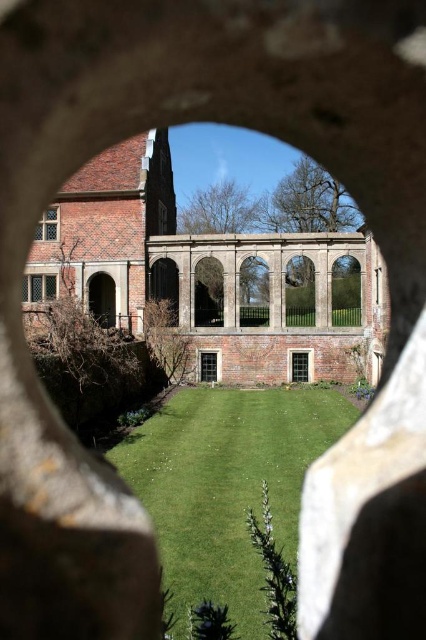
Which is more to the right, matte glass window at lower left or brick textured window at upper left?

brick textured window at upper left is more to the right.

Is point (37, 275) positioned in front of point (45, 221)?

Yes, it is.

I want to click on matte glass window at lower left, so click(x=39, y=288).

How distant is green lawn at center from matte black window at center?

A distance of 41.00 feet exists between green lawn at center and matte black window at center.

Based on the photo, is green lawn at center thinner than matte black window at center?

No.

This screenshot has width=426, height=640. What are the coordinates of `green lawn at center` in the screenshot? It's located at (227, 484).

Does green lawn at center have a lesser width compared to matte glass window at lower left?

No, green lawn at center is not thinner than matte glass window at lower left.

Locate an element on the screen. green lawn at center is located at coordinates (227, 484).